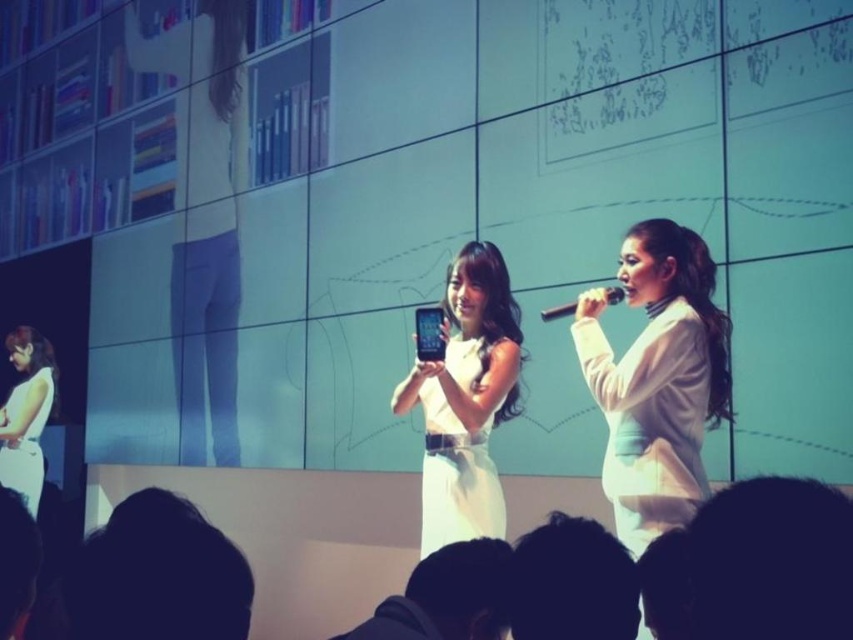
Question: Does white satin dress at center lie behind black hair at lower left?

Choices:
 (A) no
 (B) yes

Answer: (B)

Question: Which object is farther from the camera taking this photo?

Choices:
 (A) white satin dress at center
 (B) dark hair at lower left

Answer: (A)

Question: Estimate the real-world distances between objects in this image. Which object is farther from the white matte dress at left?

Choices:
 (A) black hoodie at lower center
 (B) black hair at lower left
 (C) white satin dress at center
 (D) dark hair at lower left

Answer: (D)

Question: Does white glossy phone at center appear over white matte dress at left?

Choices:
 (A) no
 (B) yes

Answer: (B)

Question: Which point is closer to the camera?

Choices:
 (A) dark hair at lower center
 (B) white glossy phone at center
 (C) black hair at lower left
 (D) black plastic microphone at center

Answer: (C)

Question: Is dark hair at lower center below white matte dress at left?

Choices:
 (A) no
 (B) yes

Answer: (A)